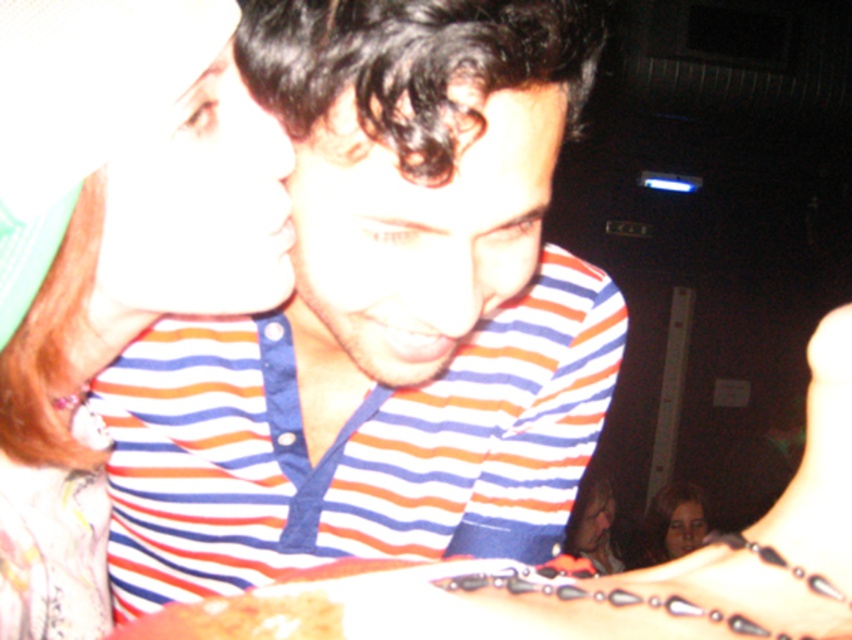
You are at a party and see the brown crumbly bread at lower left and the smooth skin face at lower right. Which object is thinner?

The brown crumbly bread at lower left is thinner than the smooth skin face at lower right.

You are at a party and see the brown crumbly bread at lower left and the smooth skin face at lower right. Which object is positioned to the left side of the other?

The brown crumbly bread at lower left is positioned to the left of the smooth skin face at lower right.